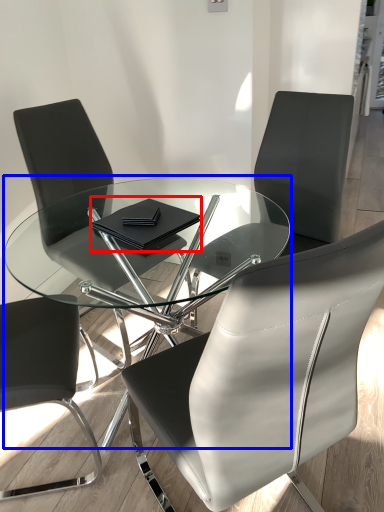
Question: Which object appears farthest to the camera in this image, notebook (highlighted by a red box) or coffee table (highlighted by a blue box)?

Choices:
 (A) notebook
 (B) coffee table

Answer: (A)